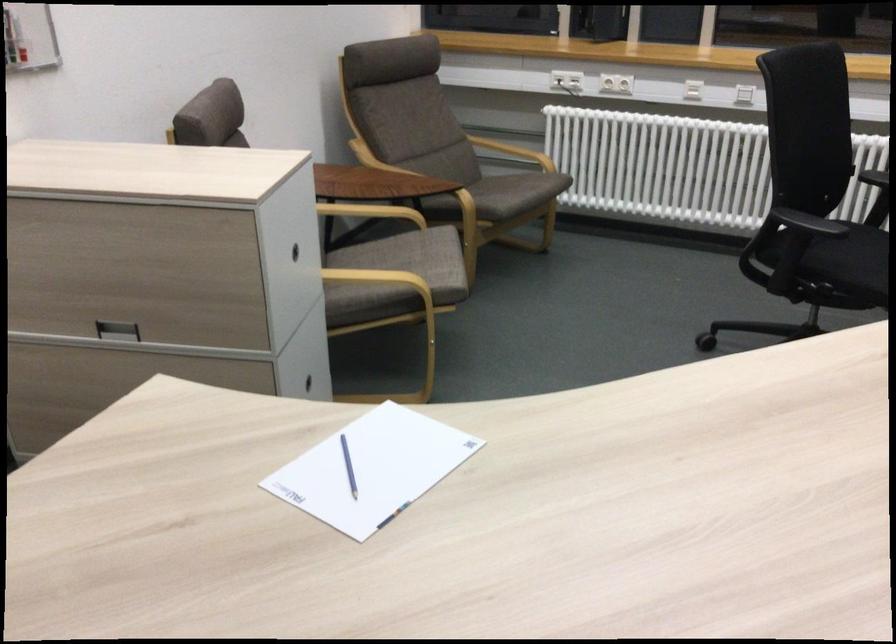
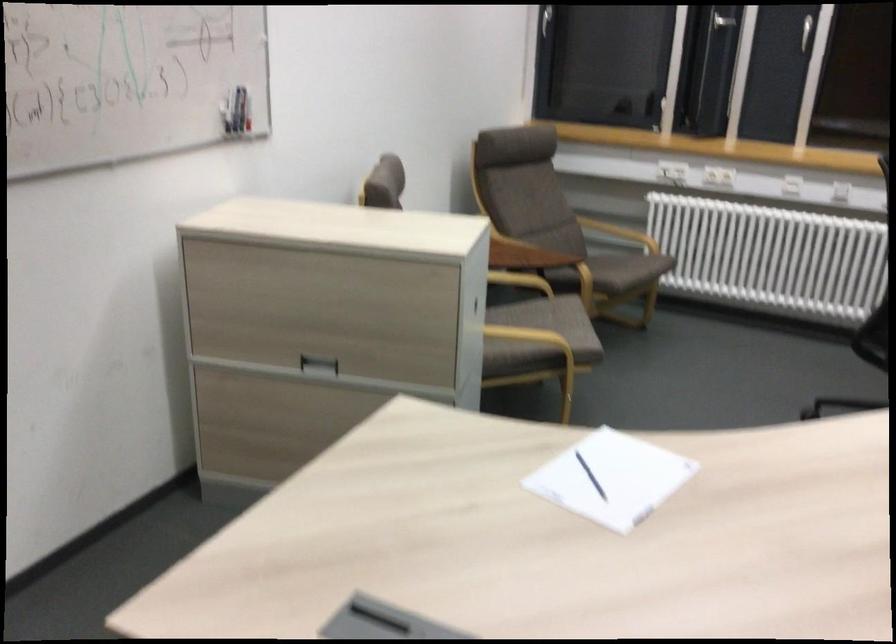
Locate, in the second image, the point that corresponds to point 383,216 in the first image.

(520, 279)